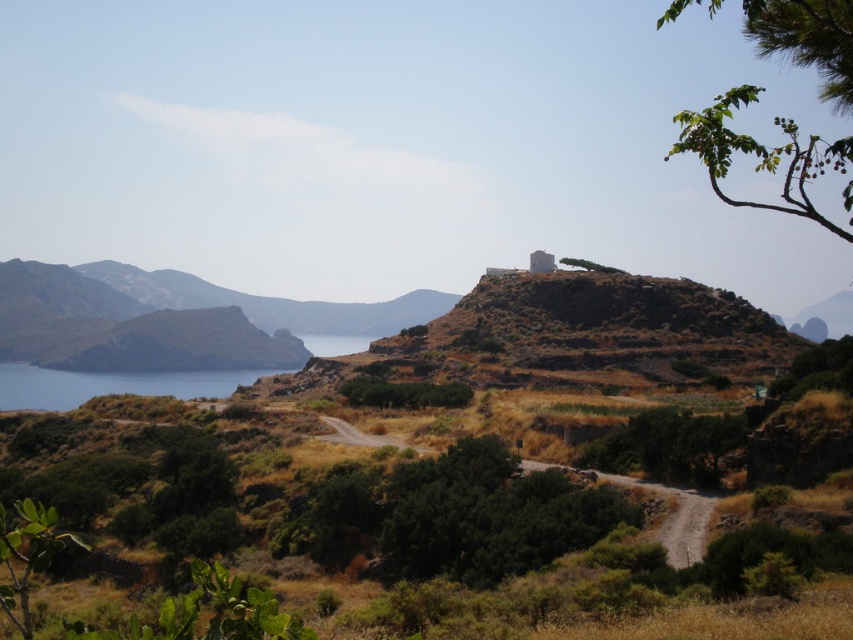
Can you confirm if blue water at lower left is positioned below brown dirt road at center?

Indeed, blue water at lower left is positioned under brown dirt road at center.

Is the position of blue water at lower left less distant than that of brown dirt road at center?

No, it is not.

I want to click on blue water at lower left, so pyautogui.click(x=109, y=385).

Locate an element on the screen. This screenshot has width=853, height=640. blue water at lower left is located at coordinates (109, 385).

Is green leafy branch at upper right shorter than brown dirt road at center?

Incorrect, green leafy branch at upper right's height does not fall short of brown dirt road at center's.

Is the position of green leafy branch at upper right less distant than that of brown dirt road at center?

Yes.

Describe the element at coordinates (766, 156) in the screenshot. I see `green leafy branch at upper right` at that location.

This screenshot has width=853, height=640. What are the coordinates of `green leafy branch at upper right` in the screenshot? It's located at (766, 156).

Between point (123, 352) and point (787, 205), which one is positioned behind?

Point (123, 352)

Between brown rocky mountain at left and green leafy branch at upper right, which one appears on the right side from the viewer's perspective?

Positioned to the right is green leafy branch at upper right.

Is point (13, 273) closer to viewer compared to point (737, 97)?

No.

I want to click on brown rocky mountain at left, so click(x=172, y=320).